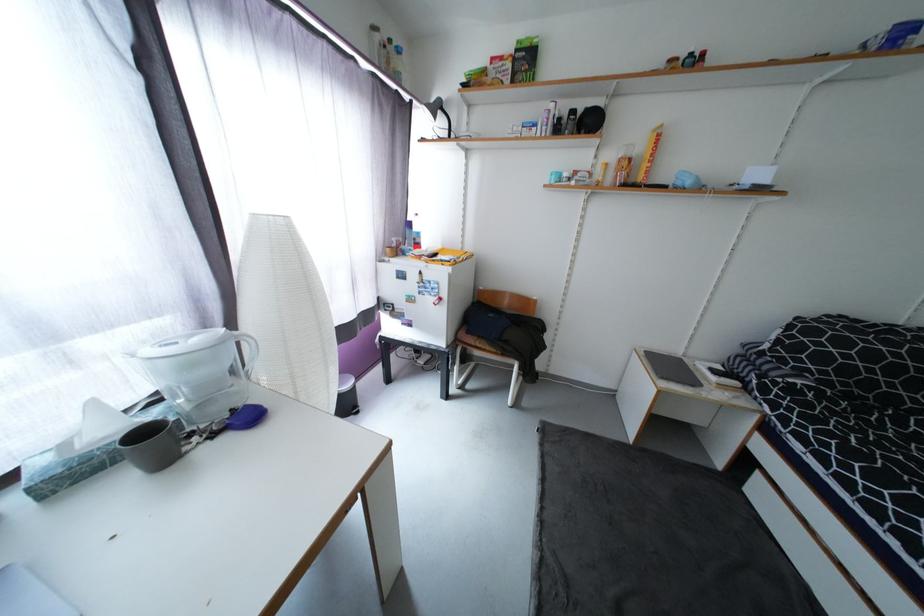
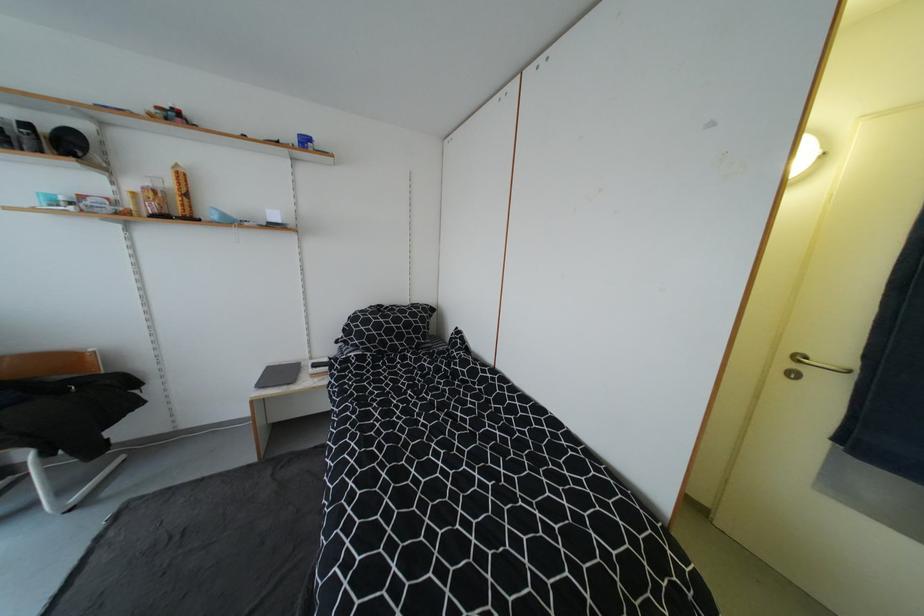
In the second image, find the point that corresponds to point (636, 161) in the first image.

(161, 193)